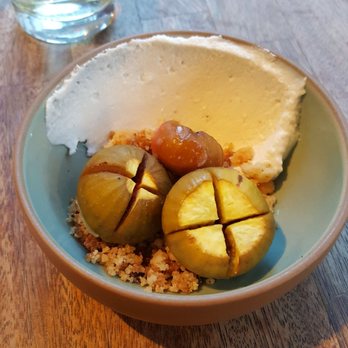
Image resolution: width=348 pixels, height=348 pixels. What are the coordinates of `brown wooden table` in the screenshot? It's located at (52, 315).